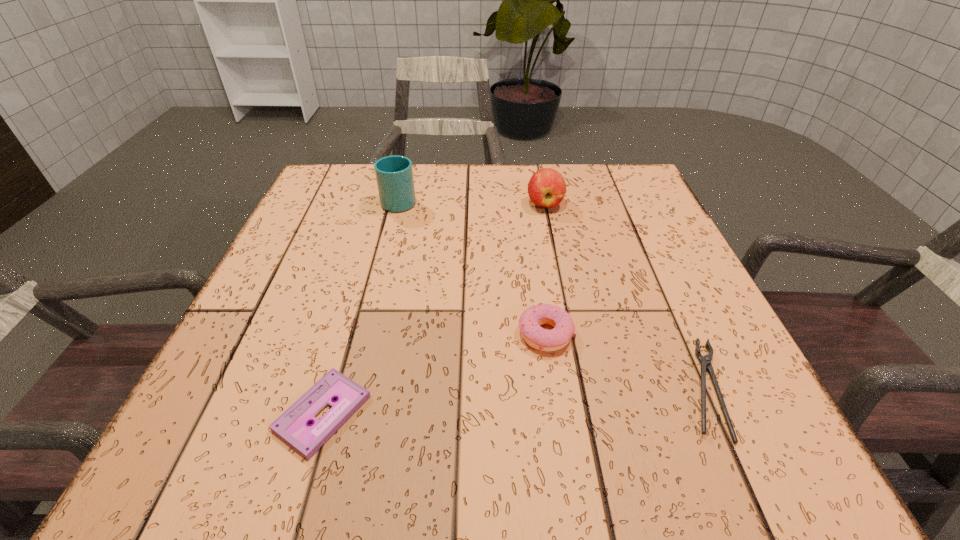
Where is `vacant area that lies between the fourth shortest object and the tongs`? vacant area that lies between the fourth shortest object and the tongs is located at coordinates (x=625, y=296).

Where is `empty space that is in between the rightmost object and the third tallest object`? The height and width of the screenshot is (540, 960). empty space that is in between the rightmost object and the third tallest object is located at coordinates (625, 361).

Identify the location of empty space that is in between the tallest object and the doughnut. This screenshot has width=960, height=540. (472, 267).

Identify which object is the third nearest to the tongs. Please provide its 2D coordinates. Your answer should be formatted as a tuple, i.e. [(x, y)], where the tuple contains the x and y coordinates of a point satisfying the conditions above.

[(292, 426)]

What are the coordinates of `object that is the closest to the videotape` in the screenshot? It's located at (534, 335).

You are a GUI agent. You are given a task and a screenshot of the screen. Output one action in this format:
    pyautogui.click(x=<x>, y=<y>)
    Task: Click on the free space that satisfies the following two spatial constraints: 1. on the front side of the doughnut; 2. on the right side of the fourth tallest object
    Image resolution: width=960 pixels, height=540 pixels.
    Given the screenshot: What is the action you would take?
    pyautogui.click(x=554, y=389)